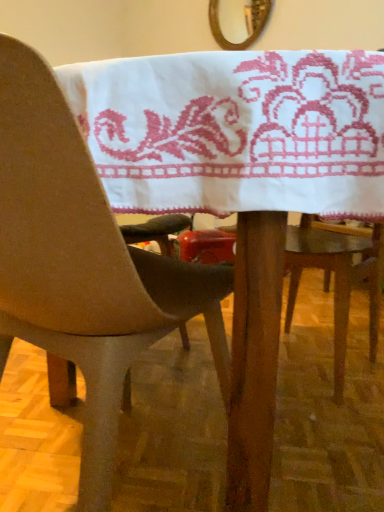
Question: Relative to wooden frame mirror at upper center, is matte plastic chair at center in front or behind?

Choices:
 (A) front
 (B) behind

Answer: (A)

Question: Based on their positions, is matte plastic chair at center located to the left or right of wooden frame mirror at upper center?

Choices:
 (A) left
 (B) right

Answer: (A)

Question: From a real-world perspective, is matte plastic chair at center physically located above or below wooden frame mirror at upper center?

Choices:
 (A) above
 (B) below

Answer: (B)

Question: Considering the positions of point (238, 47) and point (228, 367), is point (238, 47) closer or farther from the camera than point (228, 367)?

Choices:
 (A) closer
 (B) farther

Answer: (B)

Question: In the image, is wooden frame mirror at upper center on the left side or the right side of matte plastic chair at center?

Choices:
 (A) right
 (B) left

Answer: (A)

Question: From the image's perspective, is wooden frame mirror at upper center located above or below matte plastic chair at center?

Choices:
 (A) below
 (B) above

Answer: (B)

Question: From their relative heights in the image, would you say wooden frame mirror at upper center is taller or shorter than matte plastic chair at center?

Choices:
 (A) tall
 (B) short

Answer: (B)